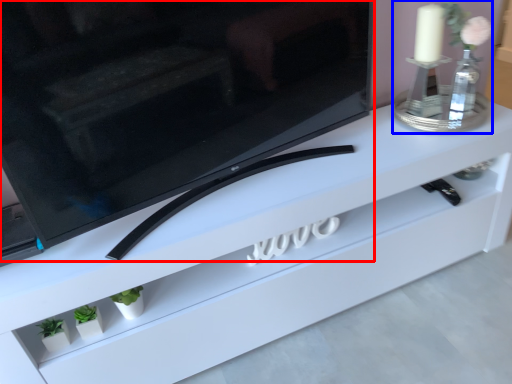
Question: Which of the following is the farthest to the observer, television (highlighted by a red box) or candle holder (highlighted by a blue box)?

Choices:
 (A) television
 (B) candle holder

Answer: (B)